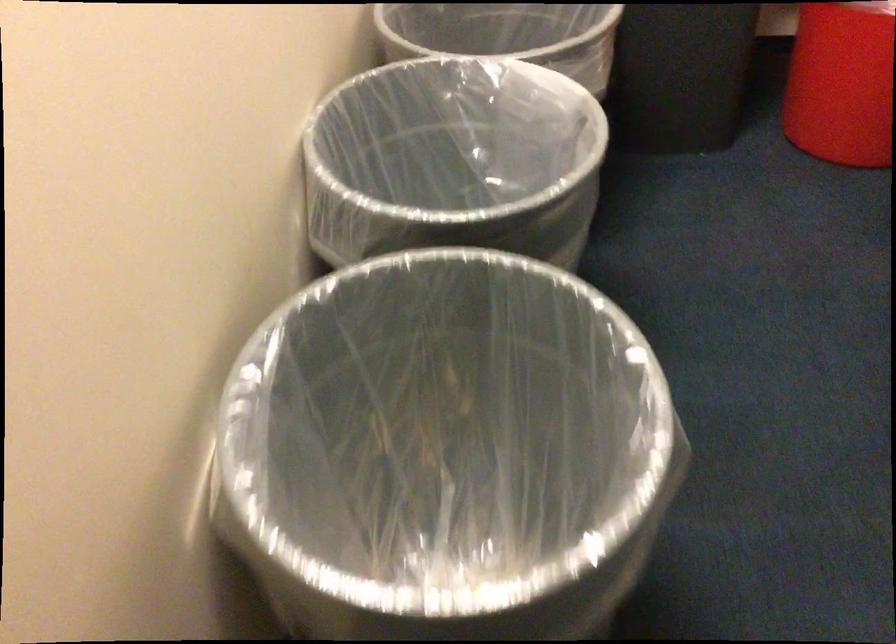
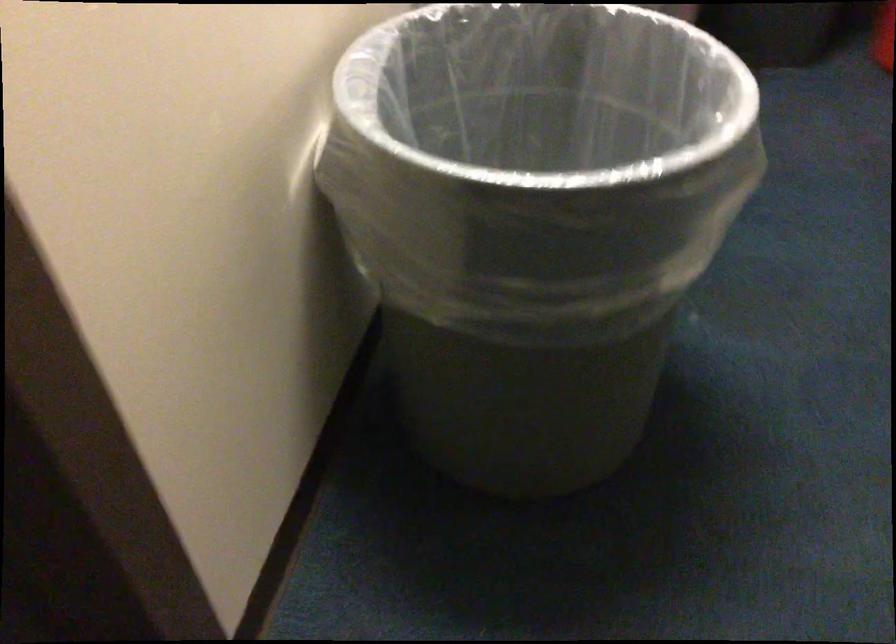
In the second image, find the point that corresponds to point (461, 365) in the first image.

(538, 136)